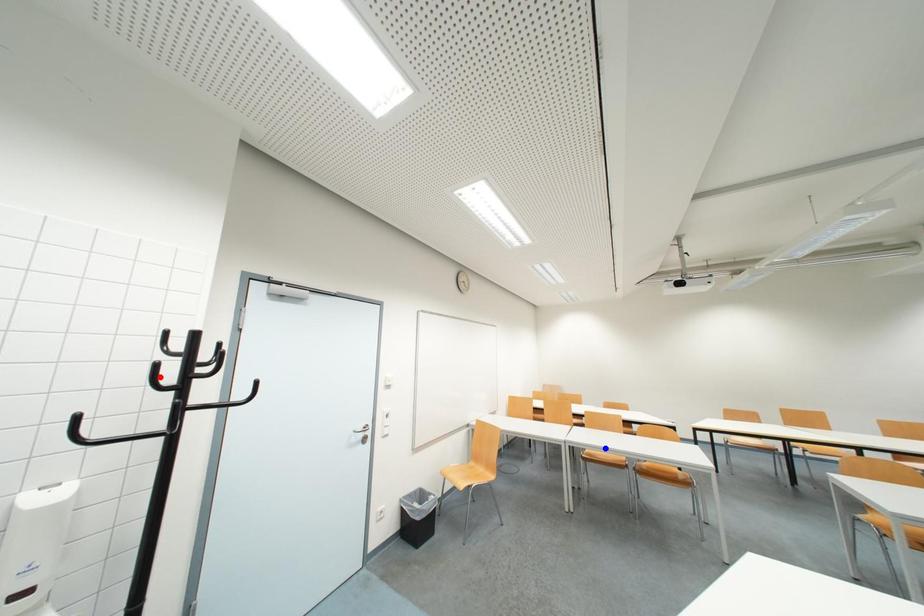
Question: In the image, two points are highlighted. Which point is nearer to the camera? Reply with the corresponding letter.

Choices:
 (A) blue point
 (B) red point

Answer: (B)